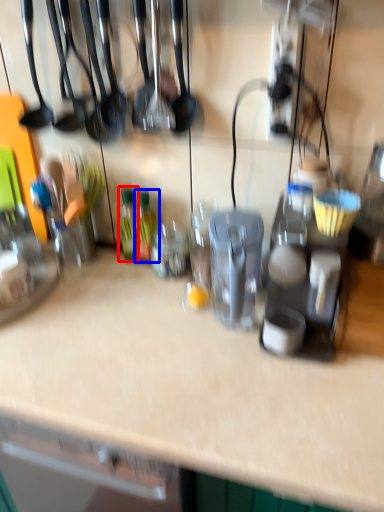
Question: Which object is closer to the camera taking this photo, bottle (highlighted by a red box) or bottle (highlighted by a blue box)?

Choices:
 (A) bottle
 (B) bottle

Answer: (B)